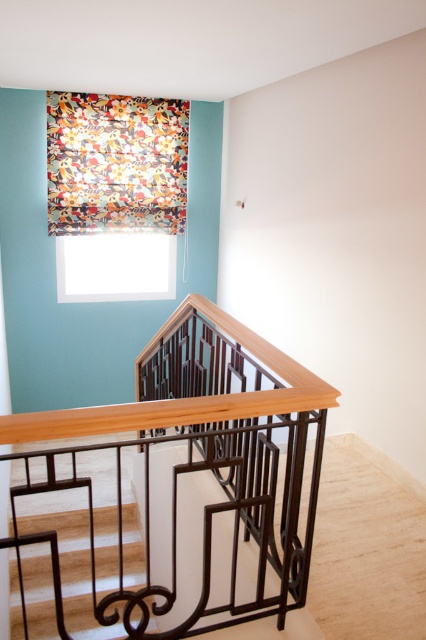
Can you confirm if woodenmetallicbalustrade at center is thinner than white matte window at upper center?

Correct, woodenmetallicbalustrade at center's width is less than white matte window at upper center's.

Which is in front, point (187, 595) or point (149, 266)?

Positioned in front is point (187, 595).

Is point (287, 484) farther from camera compared to point (112, 284)?

No, (287, 484) is in front of (112, 284).

This screenshot has height=640, width=426. I want to click on woodenmetallicbalustrade at center, so click(x=224, y=470).

Is woodenmetallicbalustrade at center smaller than floral fabric at upper left?

Actually, woodenmetallicbalustrade at center might be larger than floral fabric at upper left.

Which is above, woodenmetallicbalustrade at center or floral fabric at upper left?

Positioned higher is floral fabric at upper left.

Describe the element at coordinates (224, 470) in the screenshot. I see `woodenmetallicbalustrade at center` at that location.

This screenshot has width=426, height=640. Find the location of `woodenmetallicbalustrade at center`. woodenmetallicbalustrade at center is located at coordinates (224, 470).

Between floral fabric at upper left and white matte window at upper center, which one appears on the left side from the viewer's perspective?

white matte window at upper center

At what (x,y) coordinates should I click in order to perform the action: click on floral fabric at upper left. Please return your answer as a coordinate pair (x, y). Looking at the image, I should click on (115, 193).

Where is `floral fabric at upper left`? This screenshot has height=640, width=426. floral fabric at upper left is located at coordinates (115, 193).